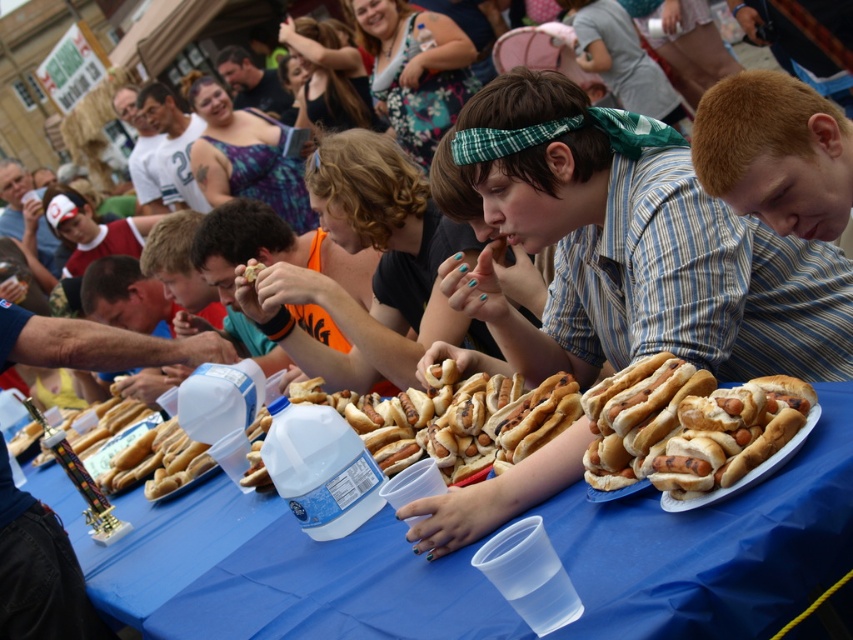
Is blue plastic table at center taller than golden brown bun at center?

In fact, blue plastic table at center may be shorter than golden brown bun at center.

Which is behind, point (112, 589) or point (608, 404)?

The point (112, 589) is more distant.

Where is `blue plastic table at center`? blue plastic table at center is located at coordinates (270, 572).

Is matte blue shirt at center further to camera compared to matte black shirt at upper center?

That is False.

Who is positioned more to the right, matte blue shirt at center or matte black shirt at upper center?

matte blue shirt at center is more to the right.

Does point (759, 353) lie in front of point (227, 51)?

Yes, it is.

Identify the location of matte blue shirt at center. Image resolution: width=853 pixels, height=640 pixels. (634, 248).

Between point (509, 96) and point (683, 388), which one is positioned in front?

Point (683, 388) is in front.

Does matte blue shirt at center appear on the left side of golden brown bun at center?

No, matte blue shirt at center is not to the left of golden brown bun at center.

Describe the element at coordinates (634, 248) in the screenshot. Image resolution: width=853 pixels, height=640 pixels. I see `matte blue shirt at center` at that location.

At what (x,y) coordinates should I click in order to perform the action: click on matte blue shirt at center. Please return your answer as a coordinate pair (x, y). This screenshot has width=853, height=640. Looking at the image, I should click on (634, 248).